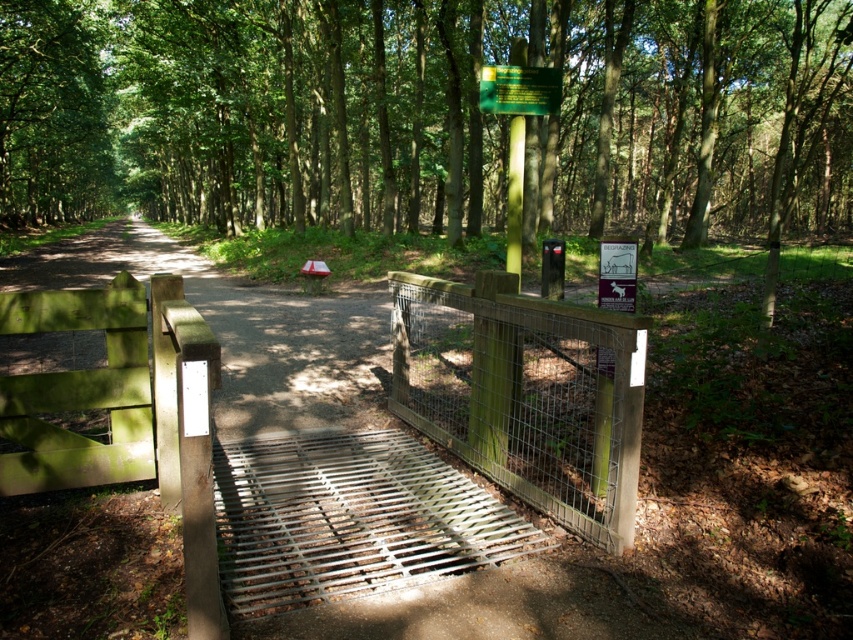
Does wooden wire mesh gate at center have a greater width compared to green matte sign at upper center?

Yes.

Can you confirm if wooden wire mesh gate at center is bigger than green matte sign at upper center?

Correct, wooden wire mesh gate at center is larger in size than green matte sign at upper center.

Who is more distant from viewer, (572, 376) or (517, 108)?

Positioned behind is point (572, 376).

This screenshot has height=640, width=853. What are the coordinates of `wooden wire mesh gate at center` in the screenshot? It's located at (526, 394).

Is green matte sign at upper center bigger than green matte pole at center?

Actually, green matte sign at upper center might be smaller than green matte pole at center.

Can you confirm if green matte sign at upper center is positioned to the right of green matte pole at center?

In fact, green matte sign at upper center is to the left of green matte pole at center.

Which is in front, point (549, 68) or point (521, 177)?

Positioned in front is point (549, 68).

This screenshot has width=853, height=640. I want to click on green matte sign at upper center, so click(x=519, y=90).

Can you confirm if wooden wire mesh gate at center is wider than green matte pole at center?

Yes, wooden wire mesh gate at center is wider than green matte pole at center.

Between wooden wire mesh gate at center and green matte pole at center, which one is positioned lower?

Positioned lower is wooden wire mesh gate at center.

Identify the location of wooden wire mesh gate at center. This screenshot has width=853, height=640. (526, 394).